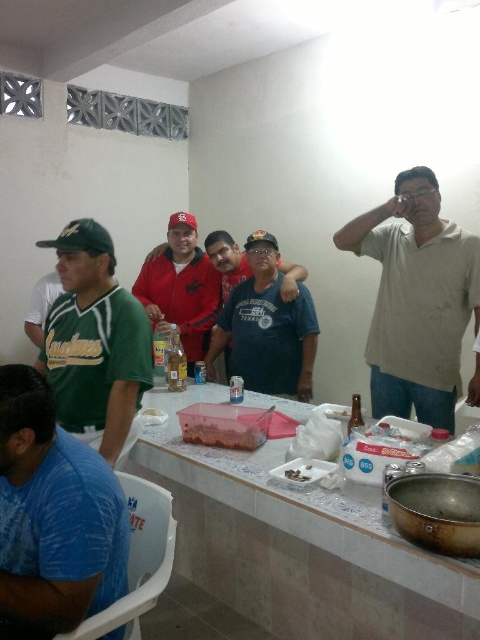
You are standing in the kitchen and want to place a small bowl on the white plastic table at center. However, there is a white matte shirt at upper right in your way. Can you still place the bowl on the table without moving the shirt?

The white plastic table at center is below the white matte shirt at upper right, so you can still place the bowl on the table without moving the shirt because the shirt is above it and not blocking the path.